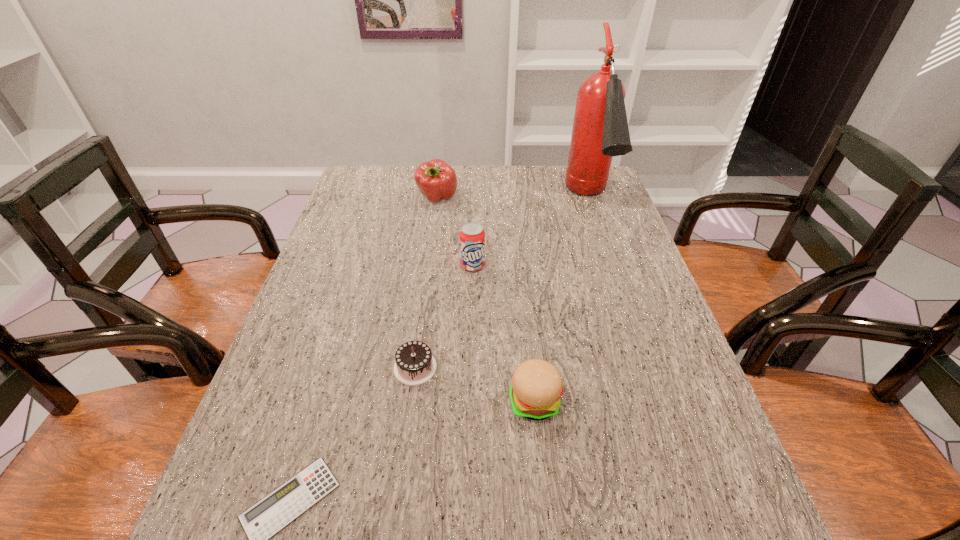
Find the location of a particular element. This screenshot has width=960, height=540. the rightmost object is located at coordinates (600, 131).

What are the coordinates of `fire extinguisher` in the screenshot? It's located at (600, 131).

You are a GUI agent. You are given a task and a screenshot of the screen. Output one action in this format:
    pyautogui.click(x=<x>, y=<y>)
    Task: Click on the pepper
    The width and height of the screenshot is (960, 540).
    Given the screenshot: What is the action you would take?
    pyautogui.click(x=435, y=179)

Where is `the fourth nearest object`? the fourth nearest object is located at coordinates (472, 235).

At what (x,y) coordinates should I click in order to perform the action: click on the third object from right to left. Please return your answer as a coordinate pair (x, y). Looking at the image, I should click on (472, 235).

Where is `hamburger`? The image size is (960, 540). hamburger is located at coordinates (536, 388).

Where is `the second object from right to left`? the second object from right to left is located at coordinates (536, 388).

This screenshot has height=540, width=960. Identify the location of chocolate cake. (415, 365).

This screenshot has height=540, width=960. What are the coordinates of `blank space located 0.240m at the nozzle end of the fire extinguisher` in the screenshot? It's located at pyautogui.click(x=621, y=291).

This screenshot has height=540, width=960. Identify the location of blank area located on the back of the pepper. (442, 167).